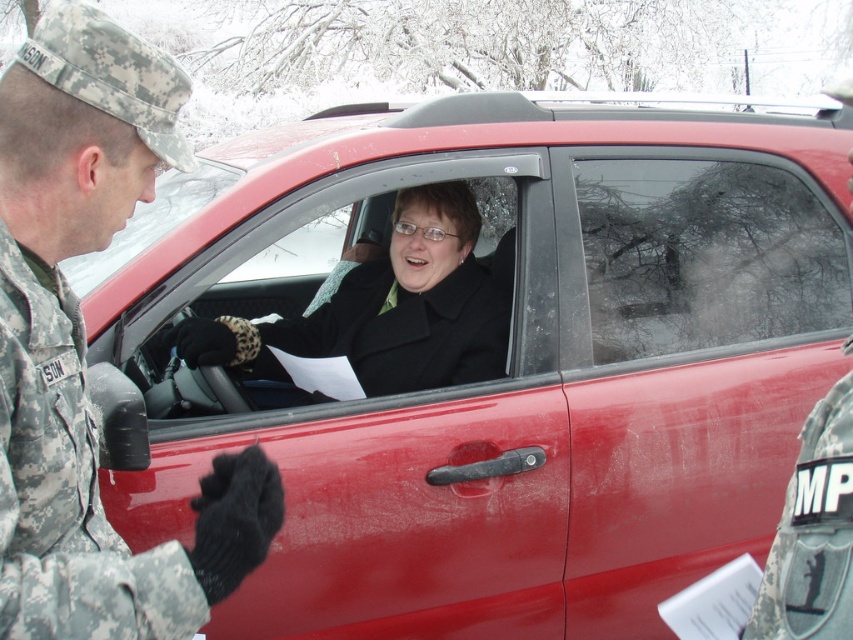
Question: Which object appears farthest from the camera in this image?

Choices:
 (A) black wool coat at center
 (B) transparent glass window at center
 (C) camouflage fabric uniform at left
 (D) camouflage uniform at left

Answer: (A)

Question: Considering the relative positions of camouflage uniform at left and black wool coat at center in the image provided, where is camouflage uniform at left located with respect to black wool coat at center?

Choices:
 (A) right
 (B) left

Answer: (B)

Question: Which of the following is the farthest from the observer?

Choices:
 (A) (843, 525)
 (B) (351, 353)

Answer: (B)

Question: In this image, where is camouflage uniform at left located relative to camouflage fabric uniform at lower right?

Choices:
 (A) below
 (B) above

Answer: (B)

Question: Does camouflage uniform at left have a greater width compared to camouflage fabric uniform at left?

Choices:
 (A) no
 (B) yes

Answer: (B)

Question: Which point is farther to the camera?

Choices:
 (A) camouflage fabric uniform at left
 (B) transparent glass window at center
 (C) camouflage uniform at left

Answer: (B)